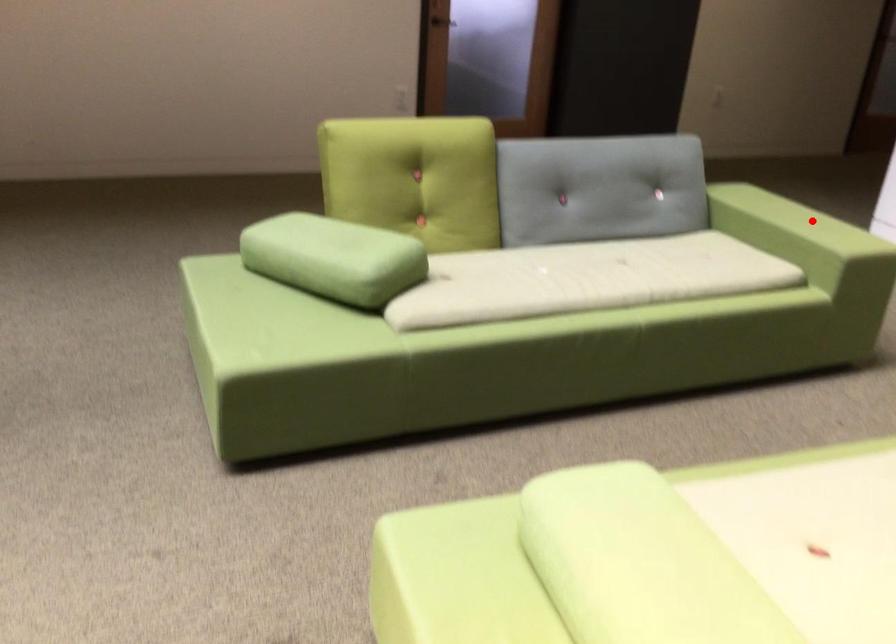
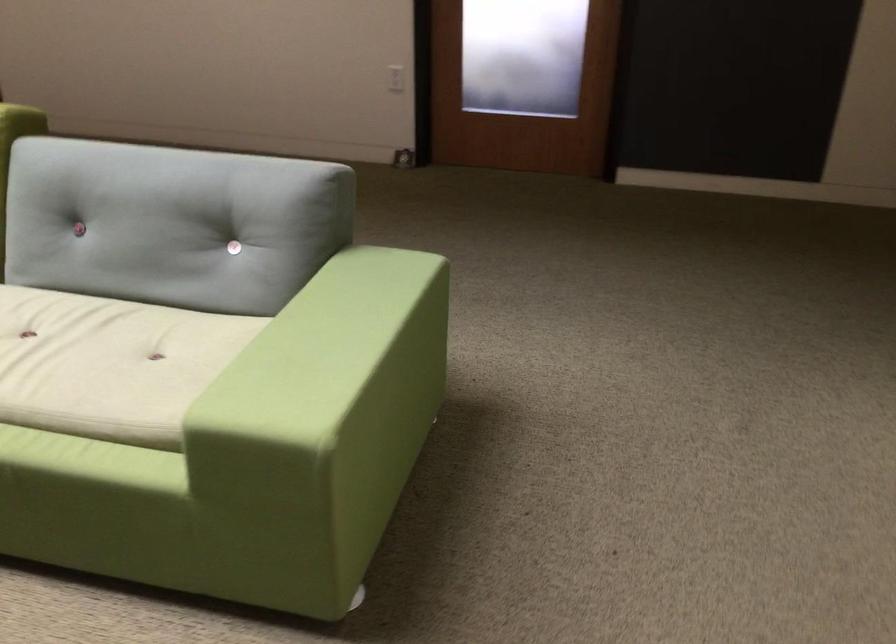
In the second image, find the point that corresponds to the highlighted location in the first image.

(323, 353)